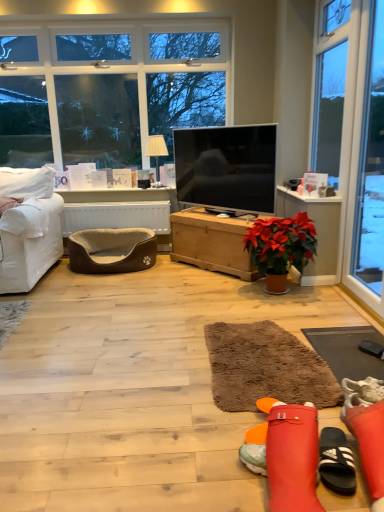
Based on the photo, in order to face white fabric lampshade at upper center, should I rotate leftwards or rightwards?

Rotate left and turn 4.751 degrees.

What is the approximate height of brown fabric pet bed at left, the first table viewed from the left?

brown fabric pet bed at left, the first table viewed from the left, is 19.29 inches tall.

Identify the location of transparent glass door at right. The width and height of the screenshot is (384, 512). (367, 169).

Measure the distance between brown shaggy rug at lower right, which is counted as the 2th flat, starting from the left, and camera.

brown shaggy rug at lower right, which is counted as the 2th flat, starting from the left, and camera are 1.82 meters apart from each other.

At what (x,y) coordinates should I click in order to perform the action: click on white fabric lampshade at upper center. Please return your answer as a coordinate pair (x, y). Looking at the image, I should click on (156, 150).

Are brown plush pet bed at lower left and brown shaggy rug at center, placed as the first flat when sorted from left to right, far apart?

That's right, there is a large distance between brown plush pet bed at lower left and brown shaggy rug at center, placed as the first flat when sorted from left to right.

Measure the distance from brown plush pet bed at lower left to brown shaggy rug at center, placed as the first flat when sorted from left to right.

They are 5.34 feet apart.

From the image's perspective, relative to brown shaggy rug at center, the 2th flat from the right, is brown plush pet bed at lower left above or below?

Based on their image positions, brown plush pet bed at lower left is located above brown shaggy rug at center, the 2th flat from the right.

From the image's perspective, would you say matte black tv at center is positioned over brown shaggy rug at lower right, which is counted as the 2th flat, starting from the left?

Yes, from the image's perspective, matte black tv at center is above brown shaggy rug at lower right, which is counted as the 2th flat, starting from the left.

Considering their positions, is matte black tv at center located in front of or behind brown shaggy rug at lower right, which is counted as the 2th flat, starting from the left?

In the image, matte black tv at center appears behind brown shaggy rug at lower right, which is counted as the 2th flat, starting from the left.

Consider the image. Is matte black tv at center next to brown shaggy rug at lower right, the first flat viewed from the right, and touching it?

No, matte black tv at center is not with brown shaggy rug at lower right, the first flat viewed from the right.

Looking at this image, is matte black tv at center spatially inside brown shaggy rug at lower right, the first flat viewed from the right, or outside of it?

matte black tv at center is not inside brown shaggy rug at lower right, the first flat viewed from the right, it's outside.

Is brown shaggy rug at lower right, which is counted as the 2th flat, starting from the left, located outside transparent glass door at right?

Indeed, brown shaggy rug at lower right, which is counted as the 2th flat, starting from the left, is completely outside transparent glass door at right.

Is brown shaggy rug at lower right, which is counted as the 2th flat, starting from the left, facing towards transparent glass door at right?

No, brown shaggy rug at lower right, which is counted as the 2th flat, starting from the left, does not turn towards transparent glass door at right.

How many degrees apart are the facing directions of brown shaggy rug at lower right, which is counted as the 2th flat, starting from the left, and transparent glass door at right?

2.3 degrees.

Is white fabric couch at left not within brown shaggy rug at lower right, the first flat viewed from the right?

That's correct, white fabric couch at left is outside of brown shaggy rug at lower right, the first flat viewed from the right.

How much distance is there between white fabric couch at left and brown shaggy rug at lower right, the first flat viewed from the right?

white fabric couch at left and brown shaggy rug at lower right, the first flat viewed from the right, are 2.08 meters apart.

Consider the image. From a real-world perspective, which is physically below, white fabric couch at left or brown shaggy rug at lower right, the first flat viewed from the right?

From a 3D spatial view, brown shaggy rug at lower right, the first flat viewed from the right, is below.

From the image's perspective, is white fabric couch at left positioned above or below brown shaggy rug at lower right, the first flat viewed from the right?

Clearly, from the image's perspective, white fabric couch at left is above brown shaggy rug at lower right, the first flat viewed from the right.

Considering the relative positions of white fabric lampshade at upper center and wooden chest at center, which is the 1th table from right to left, in the image provided, is white fabric lampshade at upper center to the left or to the right of wooden chest at center, which is the 1th table from right to left,?

From the image, it's evident that white fabric lampshade at upper center is to the left of wooden chest at center, which is the 1th table from right to left.

Considering the sizes of objects white fabric lampshade at upper center and wooden chest at center, which is the 1th table from right to left, in the image provided, who is wider, white fabric lampshade at upper center or wooden chest at center, which is the 1th table from right to left,?

Wider between the two is wooden chest at center, which is the 1th table from right to left.

Is point (150, 150) closer or farther from the camera than point (185, 232)?

Point (150, 150).

Could you measure the distance between white fabric lampshade at upper center and wooden chest at center, the 2th table in the left-to-right sequence?

The distance of white fabric lampshade at upper center from wooden chest at center, the 2th table in the left-to-right sequence, is 39.16 inches.

How many degrees apart are the facing directions of wooden chest at center, the 2th table in the left-to-right sequence, and brown shaggy rug at center, the 2th flat from the right?

The angular difference between wooden chest at center, the 2th table in the left-to-right sequence, and brown shaggy rug at center, the 2th flat from the right, is 42.7 degrees.

Between wooden chest at center, the 2th table in the left-to-right sequence, and brown shaggy rug at center, placed as the first flat when sorted from left to right, which one appears on the right side from the viewer's perspective?

Positioned to the right is brown shaggy rug at center, placed as the first flat when sorted from left to right.

Is wooden chest at center, which is the 1th table from right to left, beside brown shaggy rug at center, the 2th flat from the right?

No, wooden chest at center, which is the 1th table from right to left, is not next to brown shaggy rug at center, the 2th flat from the right.

Considering the sizes of objects wooden chest at center, the 2th table in the left-to-right sequence, and brown shaggy rug at center, placed as the first flat when sorted from left to right, in the image provided, who is thinner, wooden chest at center, the 2th table in the left-to-right sequence, or brown shaggy rug at center, placed as the first flat when sorted from left to right,?

Thinner between the two is wooden chest at center, the 2th table in the left-to-right sequence.

Is wooden chest at center, the 2th table in the left-to-right sequence, to the right of matte black tv at center from the viewer's perspective?

Yes, wooden chest at center, the 2th table in the left-to-right sequence, is to the right of matte black tv at center.

Considering the relative sizes of wooden chest at center, which is the 1th table from right to left, and matte black tv at center in the image provided, is wooden chest at center, which is the 1th table from right to left, smaller than matte black tv at center?

No.

Which object is wider, wooden chest at center, which is the 1th table from right to left, or matte black tv at center?

wooden chest at center, which is the 1th table from right to left.

What are the coordinates of `the 2nd table below the matte black tv at center (from the image's perspective)` in the screenshot? It's located at (212, 242).

In order to click on the 2nd flat positioned below the brown plush pet bed at lower left (from a real-world perspective) in this screenshot , I will do `click(266, 367)`.

Where is `television behind the brown shaggy rug at lower right, the first flat viewed from the right`? Image resolution: width=384 pixels, height=512 pixels. television behind the brown shaggy rug at lower right, the first flat viewed from the right is located at coordinates (227, 167).

Looking at the image, which one is located closer to matte black tv at center, transparent glass door at right or brown plush pet bed at lower left?

The object closer to matte black tv at center is brown plush pet bed at lower left.

Which object lies further to the anchor point brown plush pet bed at lower left, brown fabric pet bed at left, which is the 2th table from right to left, or white fabric lampshade at upper center?

white fabric lampshade at upper center is further to brown plush pet bed at lower left.

Looking at the image, which one is located closer to brown shaggy rug at center, the 2th flat from the right, matte black tv at center or white fabric lampshade at upper center?

matte black tv at center is closer to brown shaggy rug at center, the 2th flat from the right.

Looking at the image, which one is located closer to matte black tv at center, wooden chest at center, which is the 1th table from right to left, or white fabric couch at left?

wooden chest at center, which is the 1th table from right to left, lies closer to matte black tv at center than the other object.

Considering their positions, is white fabric couch at left positioned further to matte black tv at center than brown shaggy rug at lower right, which is counted as the 2th flat, starting from the left?

The object further to matte black tv at center is brown shaggy rug at lower right, which is counted as the 2th flat, starting from the left.

Which object lies nearer to the anchor point brown shaggy rug at lower right, the first flat viewed from the right, brown shaggy rug at center, the 2th flat from the right, or white fabric couch at left?

Among the two, brown shaggy rug at center, the 2th flat from the right, is located nearer to brown shaggy rug at lower right, the first flat viewed from the right.

When comparing their distances from brown shaggy rug at center, placed as the first flat when sorted from left to right, does brown plush pet bed at lower left or brown fabric pet bed at left, the first table viewed from the left, seem further?

Among the two, brown fabric pet bed at left, the first table viewed from the left, is located further to brown shaggy rug at center, placed as the first flat when sorted from left to right.

Considering their positions, is wooden chest at center, which is the 1th table from right to left, positioned closer to brown shaggy rug at center, placed as the first flat when sorted from left to right, than brown fabric pet bed at left, which is the 2th table from right to left?

wooden chest at center, which is the 1th table from right to left, is closer to brown shaggy rug at center, placed as the first flat when sorted from left to right.

You are a GUI agent. You are given a task and a screenshot of the screen. Output one action in this format:
    pyautogui.click(x=<x>, y=<y>)
    Task: Click on the lamp between white fabric couch at left and transparent glass door at right
    
    Given the screenshot: What is the action you would take?
    pyautogui.click(x=156, y=150)

This screenshot has height=512, width=384. In order to click on table located between brown plush pet bed at lower left and wooden chest at center, the 2th table in the left-to-right sequence, in the left-right direction in this screenshot , I will do `click(119, 211)`.

Locate an element on the screen. television between brown plush pet bed at lower left and wooden chest at center, the 2th table in the left-to-right sequence is located at coordinates (227, 167).

Locate an element on the screen. lamp between brown fabric pet bed at left, which is the 2th table from right to left, and wooden chest at center, which is the 1th table from right to left is located at coordinates (156, 150).